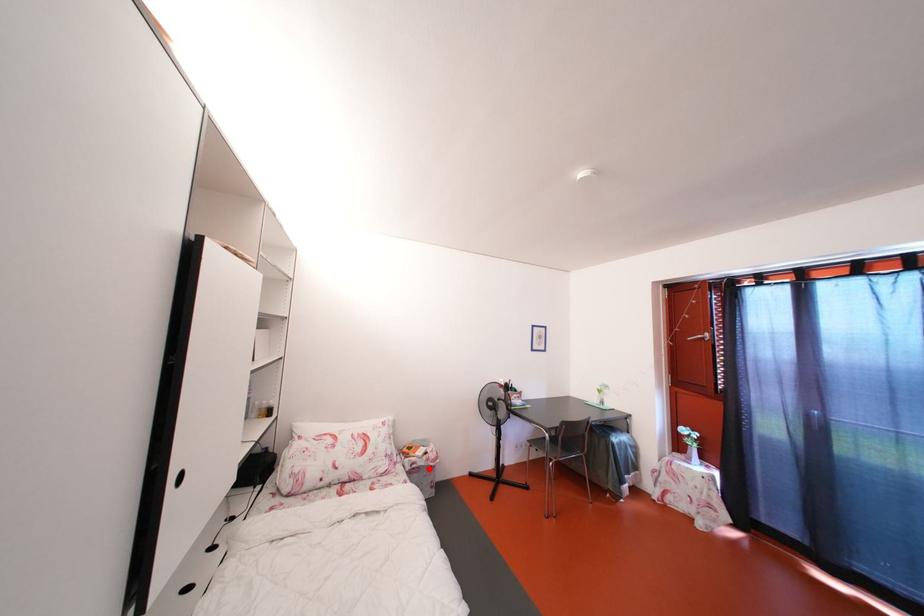
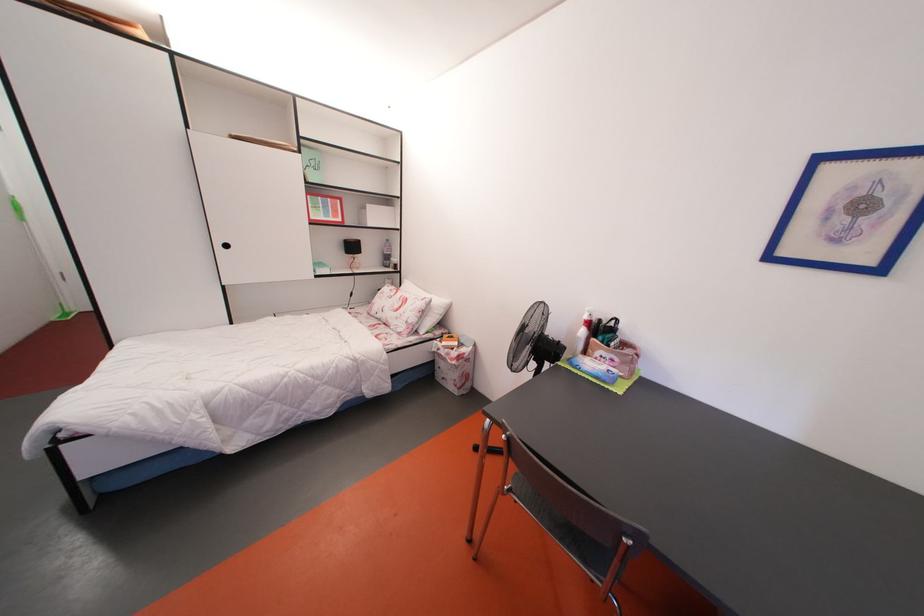
Where in the second image is the point corresponding to the highlighted location from the first image?

(450, 360)